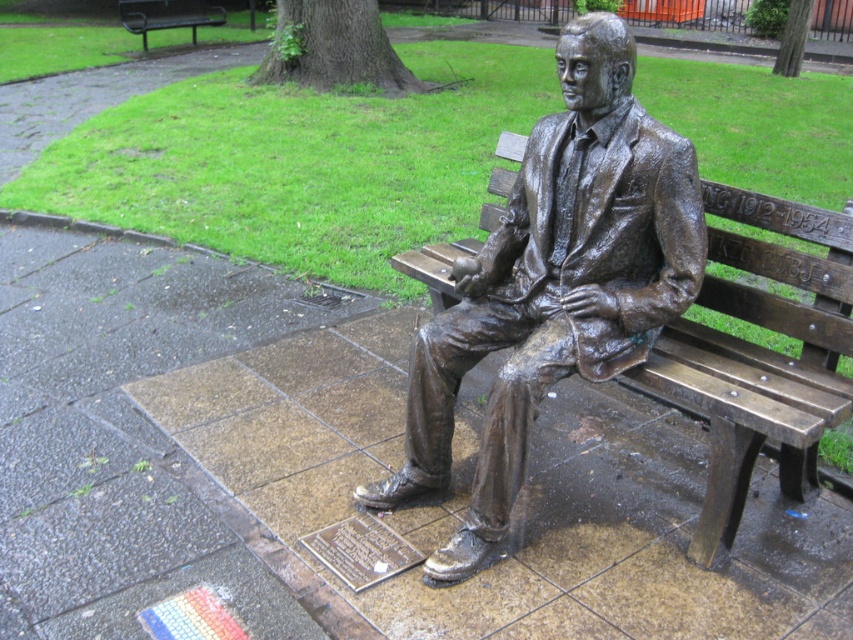
Who is more forward, [572,147] or [143,20]?

Point [572,147]

Which is more to the right, bronze statue at center or bronze bench at upper left?

From the viewer's perspective, bronze statue at center appears more on the right side.

Which is in front, point (497, 461) or point (160, 20)?

Point (497, 461) is in front.

The height and width of the screenshot is (640, 853). What are the coordinates of `bronze statue at center` in the screenshot? It's located at (554, 284).